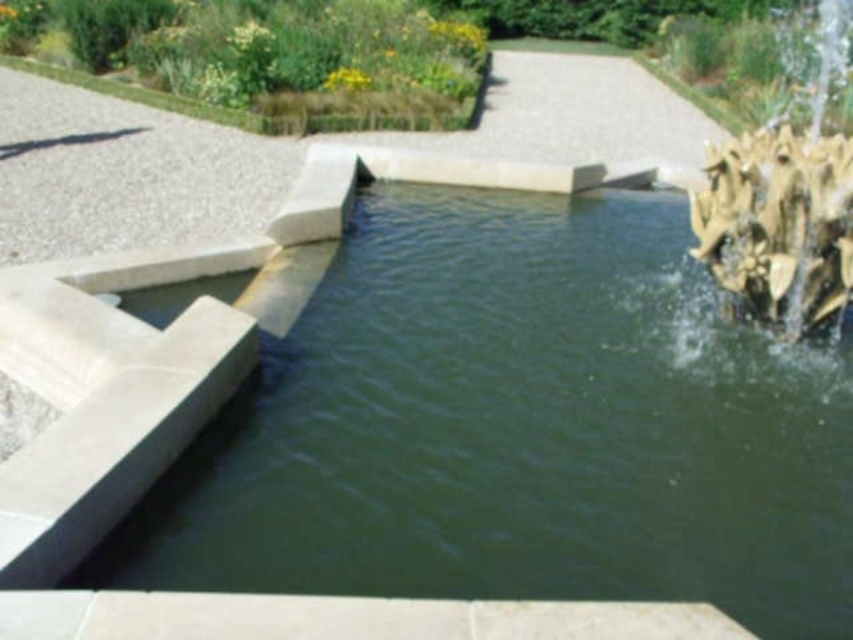
The height and width of the screenshot is (640, 853). What are the coordinates of `green stone pool at center` in the screenshot? It's located at (517, 428).

Which is behind, point (393, 282) or point (347, 44)?

The point (347, 44) is behind.

Locate an element on the screen. Image resolution: width=853 pixels, height=640 pixels. green stone pool at center is located at coordinates (517, 428).

Is green stone pool at center to the left of gold textured sculpture at right from the viewer's perspective?

Indeed, green stone pool at center is positioned on the left side of gold textured sculpture at right.

Can you confirm if green stone pool at center is positioned to the right of gold textured sculpture at right?

Incorrect, green stone pool at center is not on the right side of gold textured sculpture at right.

Between point (370, 294) and point (744, 280), which one is positioned behind?

Point (370, 294)

Locate an element on the screen. Image resolution: width=853 pixels, height=640 pixels. green stone pool at center is located at coordinates (517, 428).

Can you confirm if green grass at upper left is positioned to the right of gold textured sculpture at right?

In fact, green grass at upper left is to the left of gold textured sculpture at right.

Can you confirm if green grass at upper left is taller than gold textured sculpture at right?

No, green grass at upper left is not taller than gold textured sculpture at right.

Is point (239, 49) farther from viewer compared to point (804, 285)?

Yes, point (239, 49) is farther from viewer.

This screenshot has width=853, height=640. I want to click on green grass at upper left, so click(x=281, y=61).